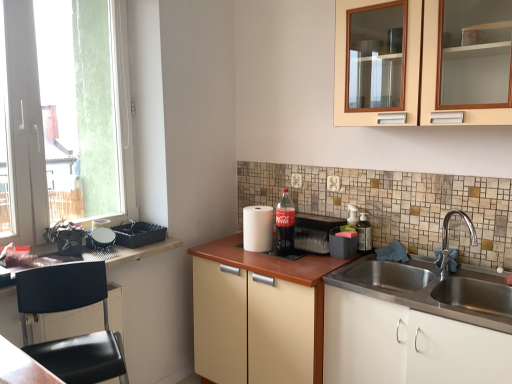
Identify the location of free space above wooden countertop at left (from a real-world perspective). (103, 248).